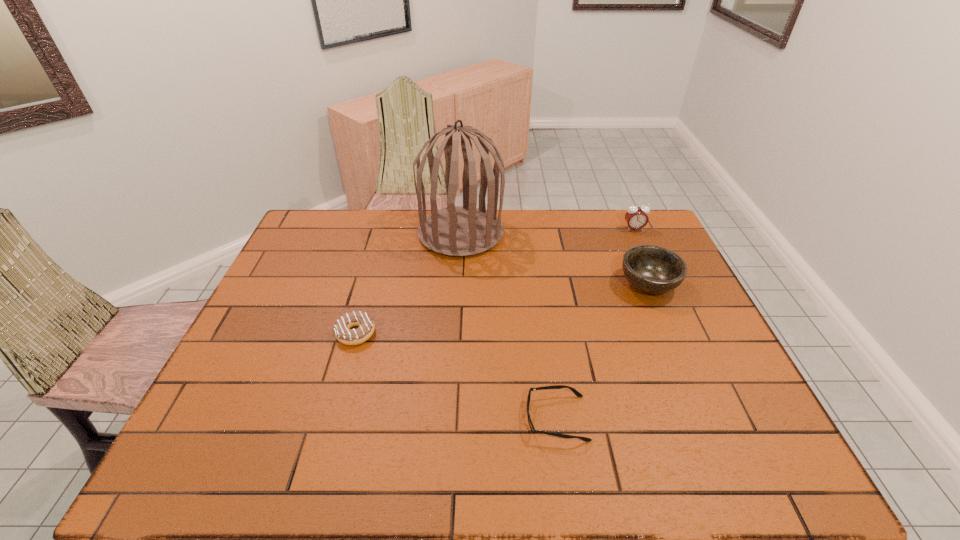
Locate an element on the screen. The height and width of the screenshot is (540, 960). vacant region located on the clock face of the fourth shortest object is located at coordinates (639, 241).

At what (x,y) coordinates should I click in order to perform the action: click on vacant space located 0.220m on the back of the bowl. Please return your answer as a coordinate pair (x, y). Image resolution: width=960 pixels, height=540 pixels. Looking at the image, I should click on (623, 226).

You are a GUI agent. You are given a task and a screenshot of the screen. Output one action in this format:
    pyautogui.click(x=<x>, y=<y>)
    Task: Click on the free region located 0.110m on the back of the doughnut
    The image size is (960, 540).
    Given the screenshot: What is the action you would take?
    [368, 292]

Find the location of `free space located on the front-facing side of the third object from right to left`. free space located on the front-facing side of the third object from right to left is located at coordinates (x=472, y=418).

Where is `free spot located 0.110m on the front-facing side of the third object from right to left`? Image resolution: width=960 pixels, height=540 pixels. free spot located 0.110m on the front-facing side of the third object from right to left is located at coordinates (477, 418).

Locate an element on the screen. free location located 0.210m on the front-facing side of the third object from right to left is located at coordinates (433, 418).

This screenshot has height=540, width=960. Find the location of `birdcage situated at the far edge`. birdcage situated at the far edge is located at coordinates (459, 231).

Where is `alarm clock present at the far edge`? This screenshot has width=960, height=540. alarm clock present at the far edge is located at coordinates (636, 217).

The width and height of the screenshot is (960, 540). I want to click on object positioned at the near edge, so click(x=573, y=390).

You are a GUI agent. You are given a task and a screenshot of the screen. Output one action in this format:
    pyautogui.click(x=<x>, y=<y>)
    Task: Click on the alarm clock that is at the right edge
    
    Given the screenshot: What is the action you would take?
    pyautogui.click(x=636, y=217)